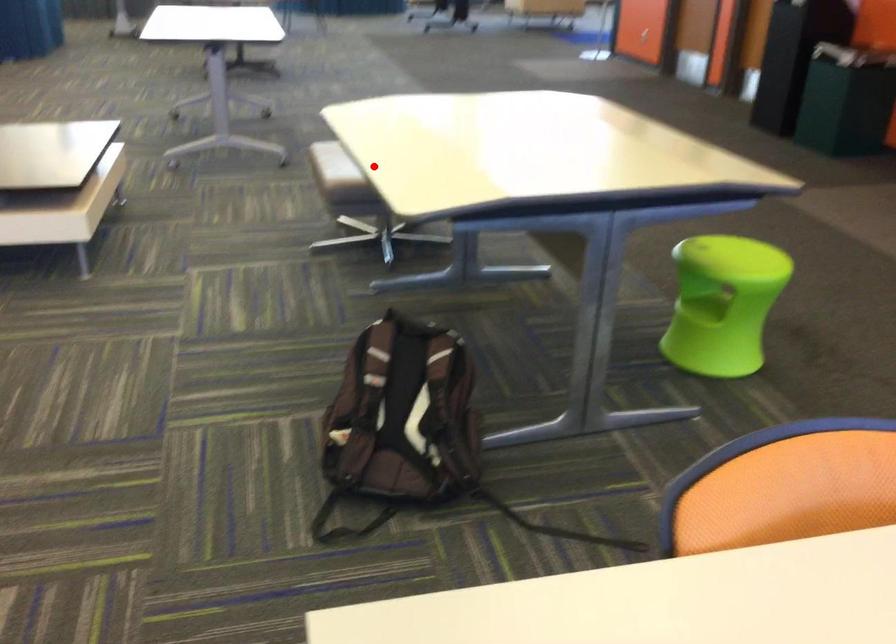
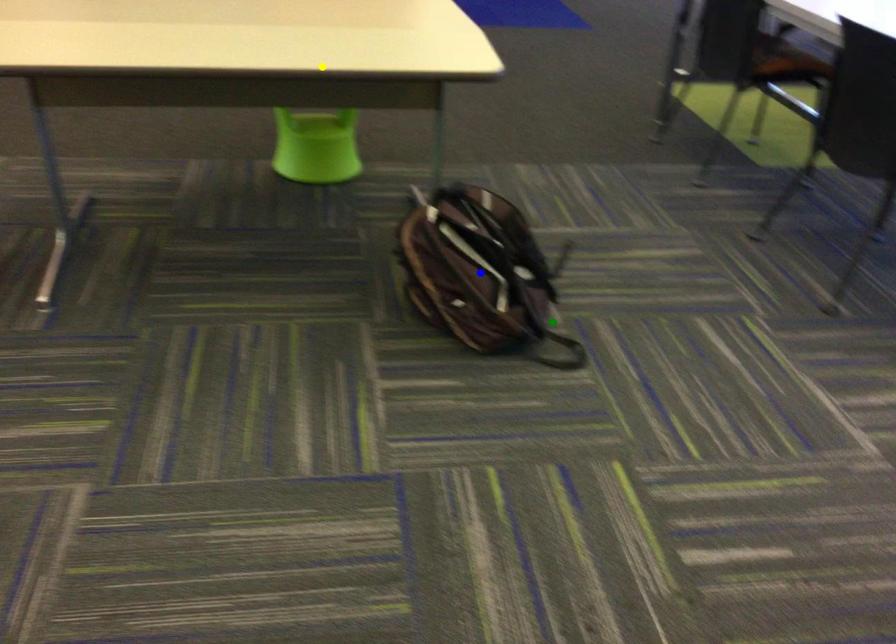
Question: I am providing you with two images of the same scene from different viewpoints. A red point is marked on the first image. You are given multiple points on the second image. Which point in image 2 represents the same 3d spot as the red point in image 1?

Choices:
 (A) yellow point
 (B) green point
 (C) blue point

Answer: (A)